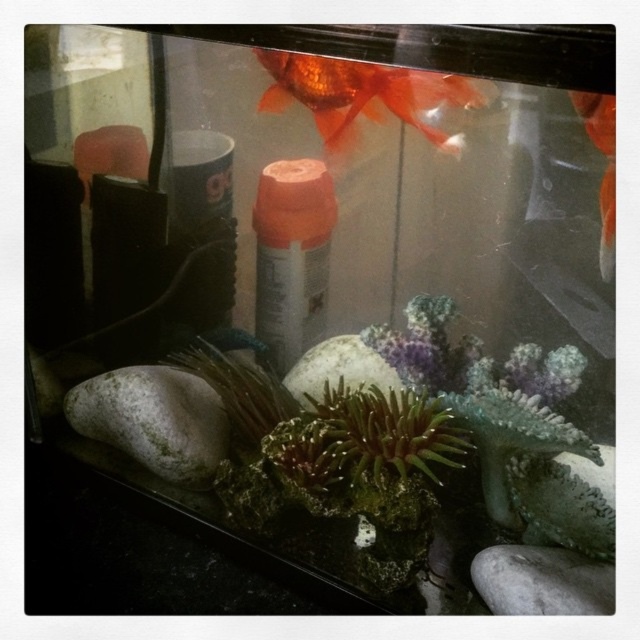
Question: Which object appears farthest from the camera in this image?

Choices:
 (A) gray matte rock at lower right
 (B) orange glossy goldfish at upper right
 (C) white matte rock at center-left

Answer: (C)

Question: Which point is farther to the camera?

Choices:
 (A) gray matte rock at lower right
 (B) white matte rock at center-left

Answer: (B)

Question: Does white matte rock at center-left appear under orange glossy goldfish at upper right?

Choices:
 (A) no
 (B) yes

Answer: (B)

Question: Is shiny orange fish at upper center positioned behind gray matte rock at lower right?

Choices:
 (A) no
 (B) yes

Answer: (A)

Question: Where is white matte rock at center-left located in relation to gray matte rock at lower right in the image?

Choices:
 (A) below
 (B) above

Answer: (B)

Question: Which of the following is the closest to the observer?

Choices:
 (A) (560, 554)
 (B) (390, 81)
 (C) (296, 374)

Answer: (A)